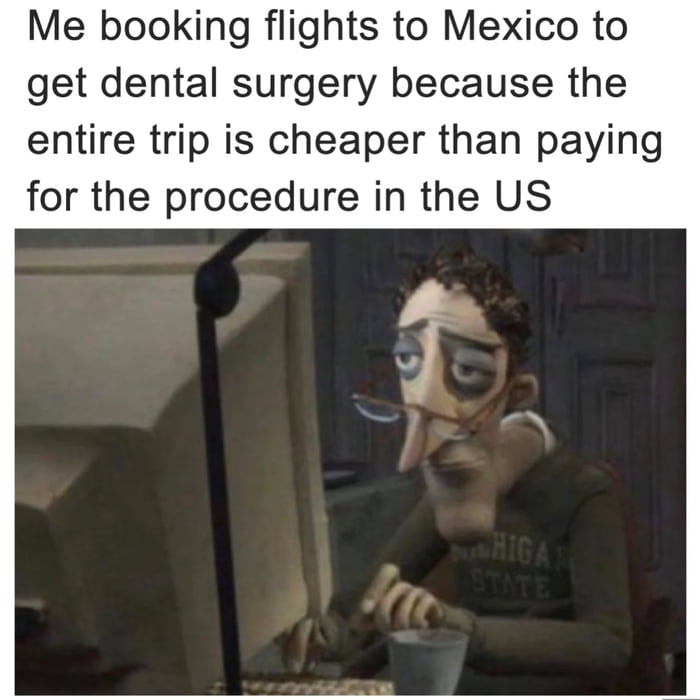
What are the coordinates of `mug` in the screenshot? It's located at (428, 685).